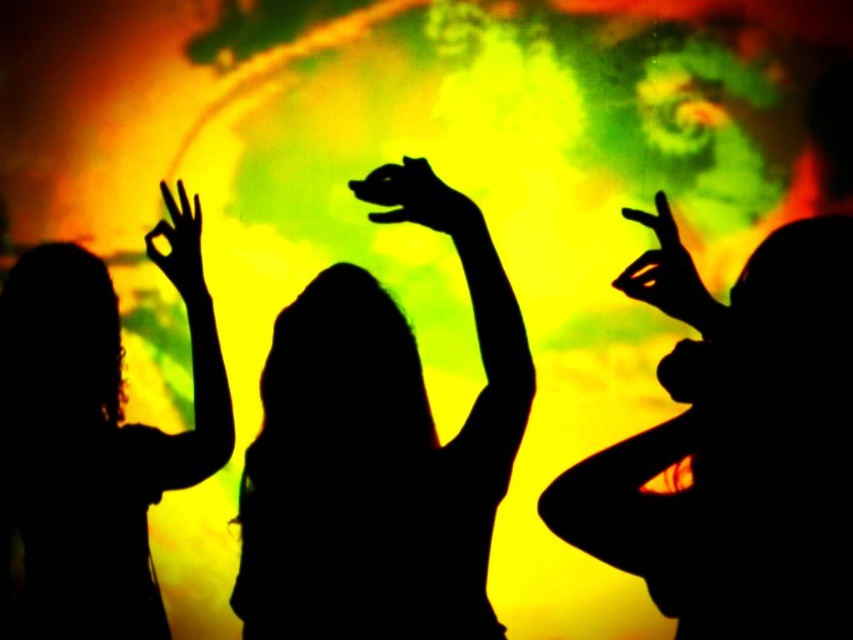
Question: Is black silhouette at left to the right of black matte hand at center from the viewer's perspective?

Choices:
 (A) no
 (B) yes

Answer: (A)

Question: Which object is positioned farthest from the black matte hand at upper left?

Choices:
 (A) black silhouette at center
 (B) black silhouette at left
 (C) black matte hand at upper right
 (D) black matte hand at center

Answer: (C)

Question: Which point is closer to the camera?

Choices:
 (A) black matte hand at center
 (B) black matte hand at upper right
 (C) black silhouette at center
 (D) black silhouette at left

Answer: (B)

Question: Which of the following is the closest to the observer?

Choices:
 (A) black matte hand at upper left
 (B) black silhouette at center
 (C) black matte hand at center
 (D) black matte hand at upper right

Answer: (D)

Question: Can you confirm if black silhouette at center is smaller than black matte hand at upper right?

Choices:
 (A) no
 (B) yes

Answer: (A)

Question: Where is black silhouette at left located in relation to black matte hand at center in the image?

Choices:
 (A) right
 (B) left

Answer: (B)